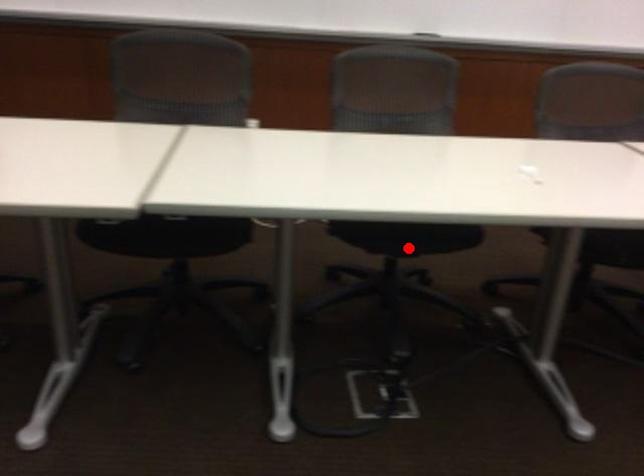
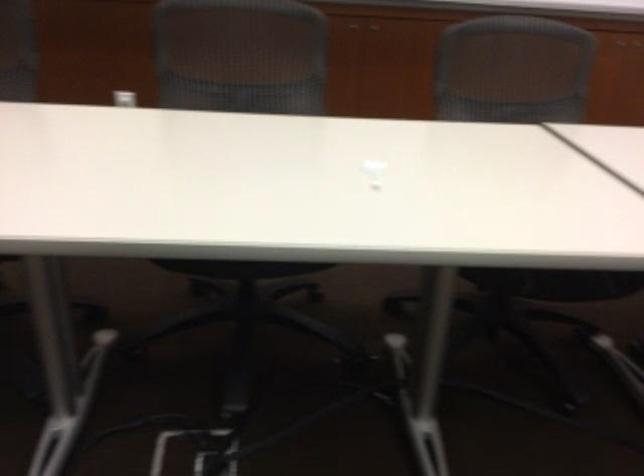
Where in the second image is the point corresponding to the highlighted location from the first image?

(239, 268)